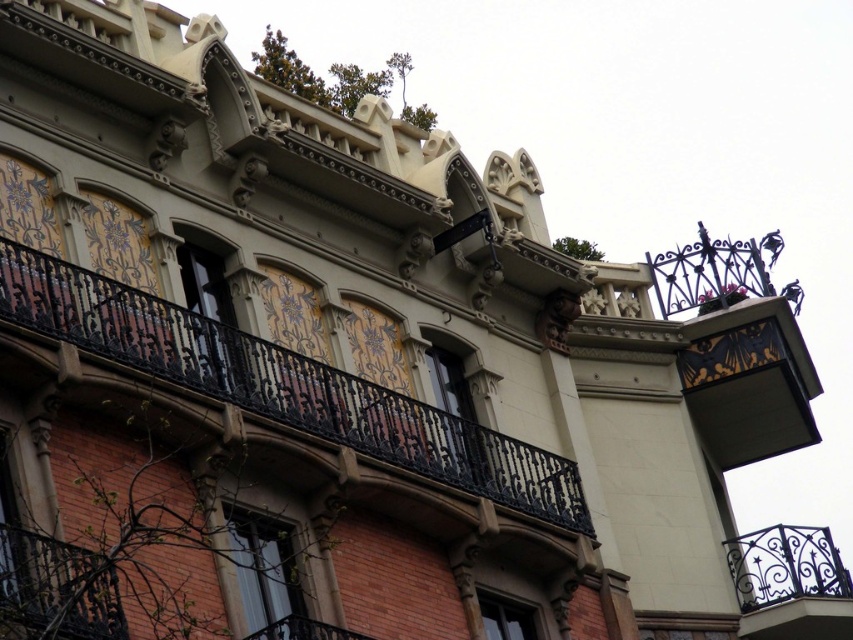
Question: Among these points, which one is farthest from the camera?

Choices:
 (A) (141, 358)
 (B) (71, 632)

Answer: (A)

Question: Considering the relative positions of black wrought iron balcony at center and wrought iron balcony at upper right in the image provided, where is black wrought iron balcony at center located with respect to wrought iron balcony at upper right?

Choices:
 (A) above
 (B) below

Answer: (A)

Question: Based on their relative distances, which object is nearer to the black wrought iron balcony at lower left?

Choices:
 (A) wrought iron balcony at upper right
 (B) black wrought iron balcony at center

Answer: (B)

Question: Can you confirm if wrought iron balcony at upper right is positioned above black wrought iron balcony at lower left?

Choices:
 (A) no
 (B) yes

Answer: (A)

Question: Can you confirm if wrought iron balcony at upper right is smaller than black wrought iron balcony at lower left?

Choices:
 (A) no
 (B) yes

Answer: (A)

Question: Which of the following is the closest to the observer?

Choices:
 (A) (3, 285)
 (B) (22, 532)

Answer: (B)